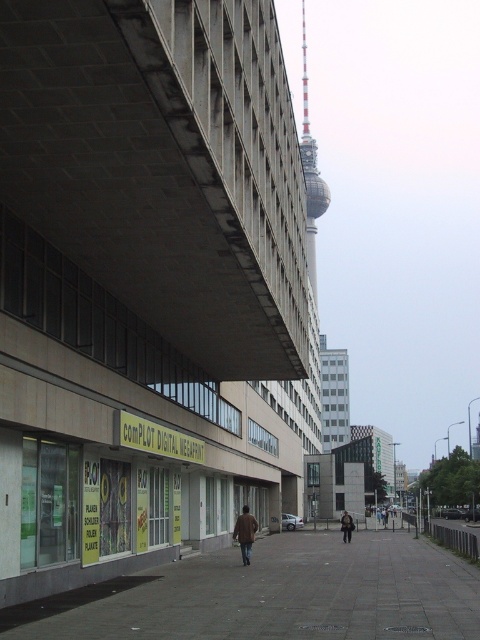
Is brown leather coat at center taller than brown leather jacket at center?

No, brown leather coat at center is not taller than brown leather jacket at center.

Between point (244, 538) and point (386, 513), which one is positioned behind?

Positioned behind is point (386, 513).

Find the location of `brown leather coat at center`. brown leather coat at center is located at coordinates coord(244,532).

Can you confirm if concrete at upper left is bigger than brown leather jacket at center?

No, concrete at upper left is not bigger than brown leather jacket at center.

Does point (107, 36) come farther from viewer compared to point (384, 516)?

No, it is not.

Is point (169, 88) positioned behind point (386, 516)?

That is False.

Identify the location of concrete at upper left. (165, 166).

In the scene shown: Which is above, gray concrete pavement at center or brown leather coat at center?

Positioned higher is gray concrete pavement at center.

This screenshot has height=640, width=480. In order to click on gray concrete pavement at center in this screenshot , I will do `click(287, 595)`.

The height and width of the screenshot is (640, 480). I want to click on gray concrete pavement at center, so click(x=287, y=595).